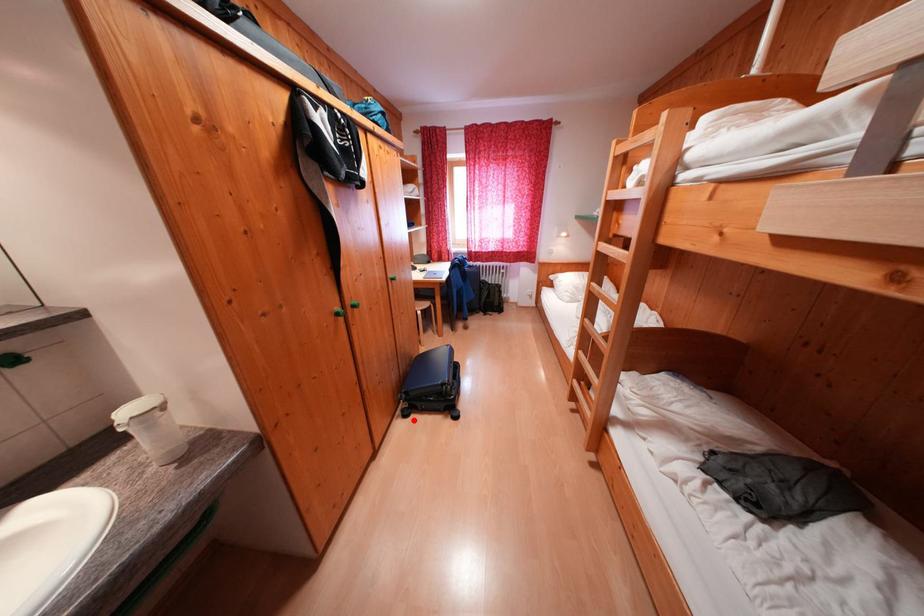
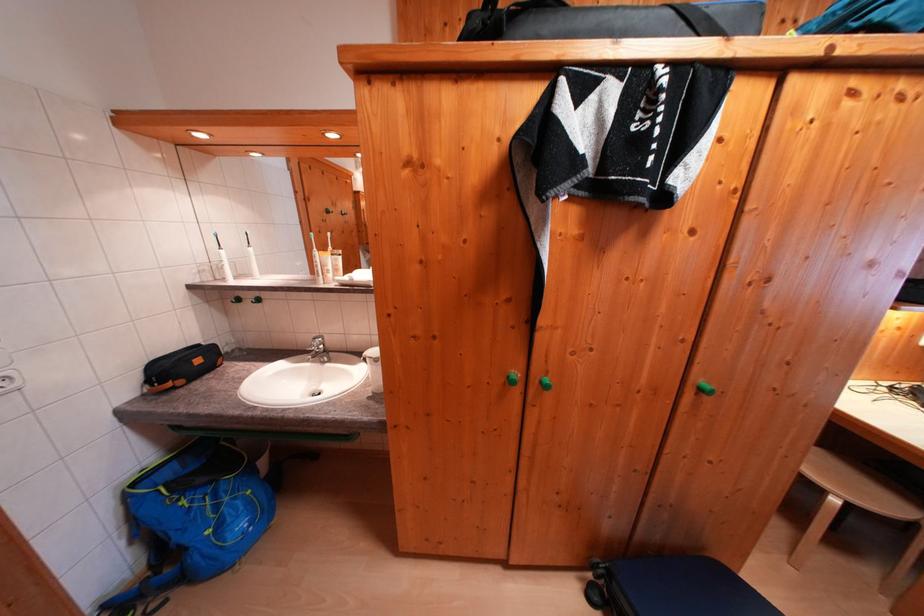
Question: A red point is marked in image1. In image2, is the corresponding 3D point closer to the camera or farther? Reply with the corresponding letter.

Choices:
 (A) The corresponding 3D point is closer.
 (B) The corresponding 3D point is farther.

Answer: (A)